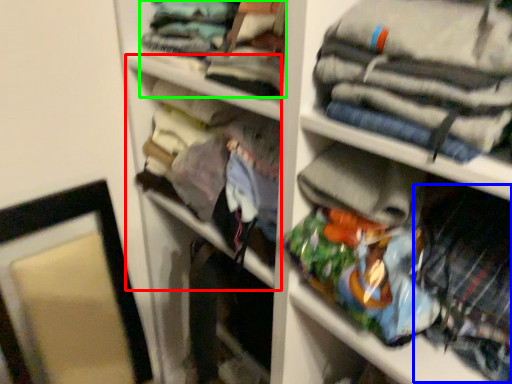
Question: Estimate the real-world distances between objects in this image. Which object is closer to cabinet (highlighted by a red box), clothing (highlighted by a blue box) or clothing (highlighted by a green box)?

Choices:
 (A) clothing
 (B) clothing

Answer: (B)